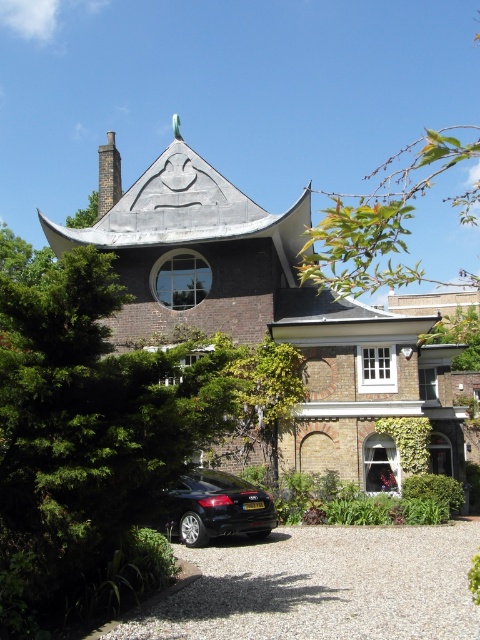
You are standing at the entrance of the building and want to walk to the gravel driveway at lower center. There is a dark gray stone chimney at upper left nearby. Which direction should you turn to reach the driveway?

The gravel driveway at lower center is shorter than the dark gray stone chimney at upper left, so you should turn towards the lower center direction to reach the driveway.

You are standing in front of the building and notice two points marked on its facade. The first point is at coordinate point (x=179, y=550) and the second is at point (x=120, y=179). Which of these two points is closer to you?

Point (x=179, y=550) is closer to the viewer than point (x=120, y=179).